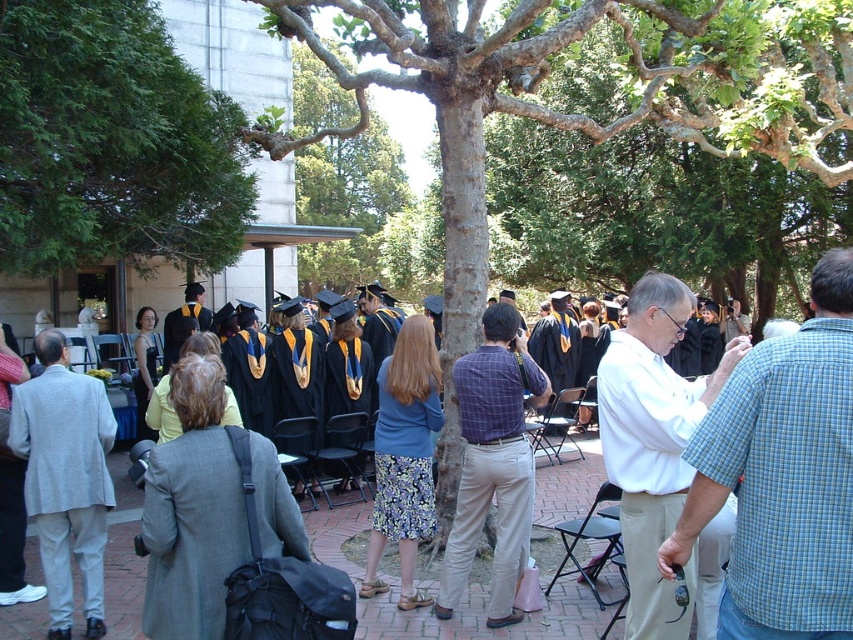
Between green leafy tree at upper left and white shirt at center, which one is positioned lower?

white shirt at center is lower down.

Is green leafy tree at upper left wider than white shirt at center?

Yes.

What are the coordinates of `green leafy tree at upper left` in the screenshot? It's located at (111, 141).

Does green textured tree at center have a smaller size compared to plaid shirt at center?

Actually, green textured tree at center might be larger than plaid shirt at center.

Is point (753, 61) more distant than point (480, 493)?

Yes, it is.

Locate an element on the screen. The height and width of the screenshot is (640, 853). green textured tree at center is located at coordinates (584, 113).

Is point (74, 49) closer to camera compared to point (242, 403)?

Yes, point (74, 49) is in front of point (242, 403).

Between green leafy tree at upper left and black matte graduation gown at center, which one appears on the left side from the viewer's perspective?

From the viewer's perspective, green leafy tree at upper left appears more on the left side.

Which is behind, point (48, 8) or point (252, 349)?

Positioned behind is point (252, 349).

The height and width of the screenshot is (640, 853). I want to click on green leafy tree at upper left, so click(x=111, y=141).